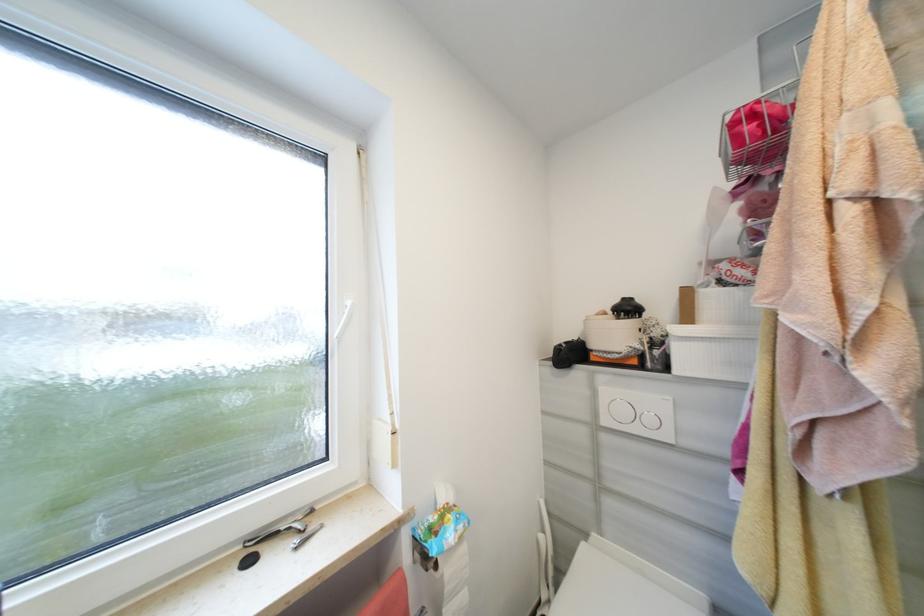
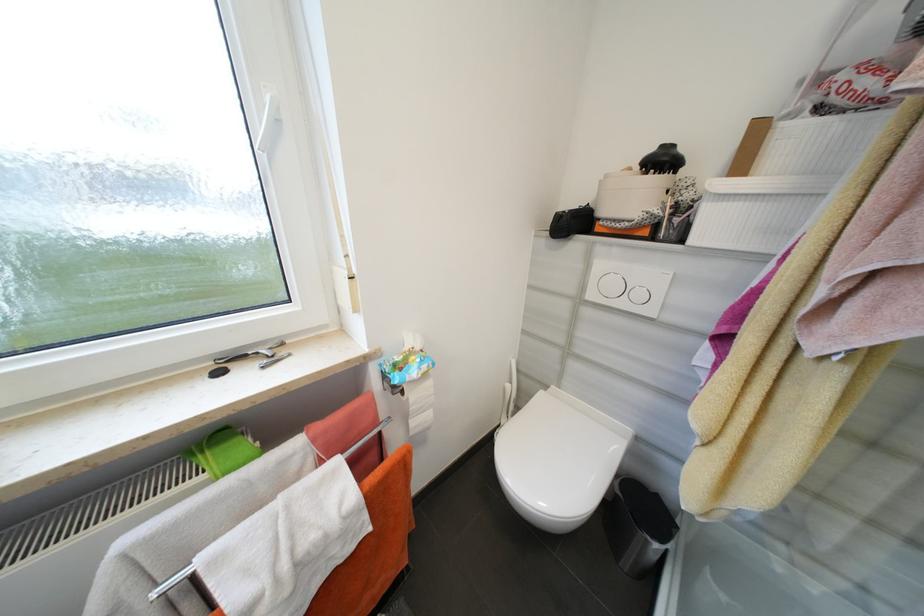
In the second image, find the point that corresponds to the point at 643,347 in the first image.

(663, 213)